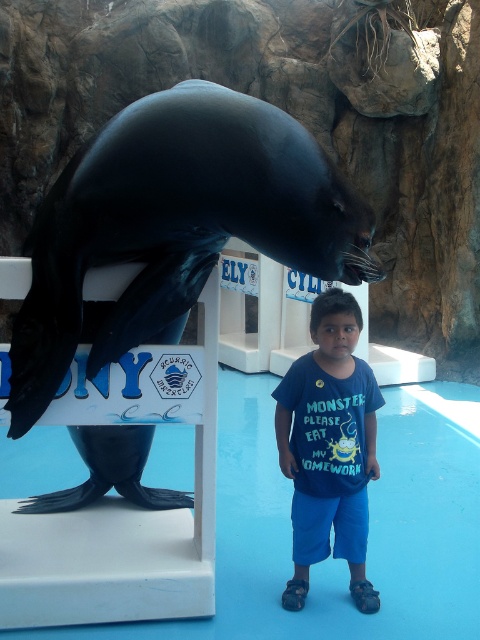
You are a parent at the aquarium with your child. You notice the shiny black seal at center and the blue cotton shirt at center. Which object is bigger?

The shiny black seal at center is larger than the blue cotton shirt at center.

You are a visitor at the aquarium and want to take a photo of the two points mentioned in the scene. Which point, point [213,264] or point [373,433], is closer to you?

Point [213,264] is closer to the viewer than point [373,433].